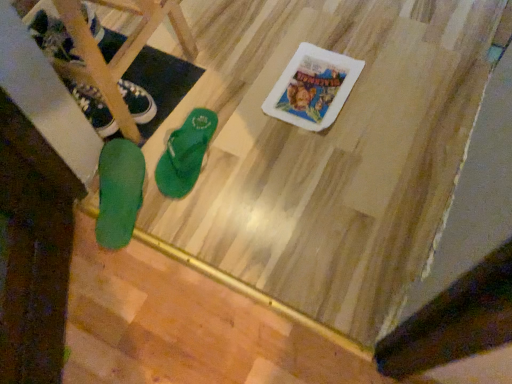
Where is `vacant space underneath green rubber flip-flop at center, the third footwear from the left (from a real-world perspective)`? vacant space underneath green rubber flip-flop at center, the third footwear from the left (from a real-world perspective) is located at coordinates (189, 151).